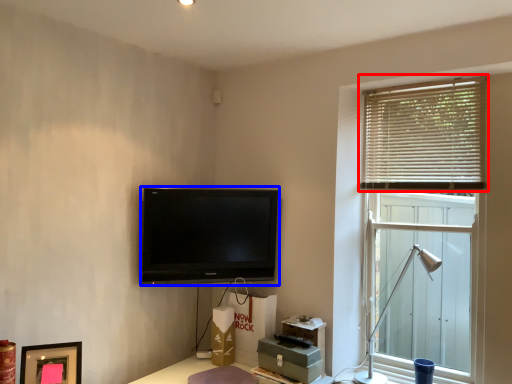
Question: Which object appears farthest to the camera in this image, window blind (highlighted by a red box) or television (highlighted by a blue box)?

Choices:
 (A) window blind
 (B) television

Answer: (B)